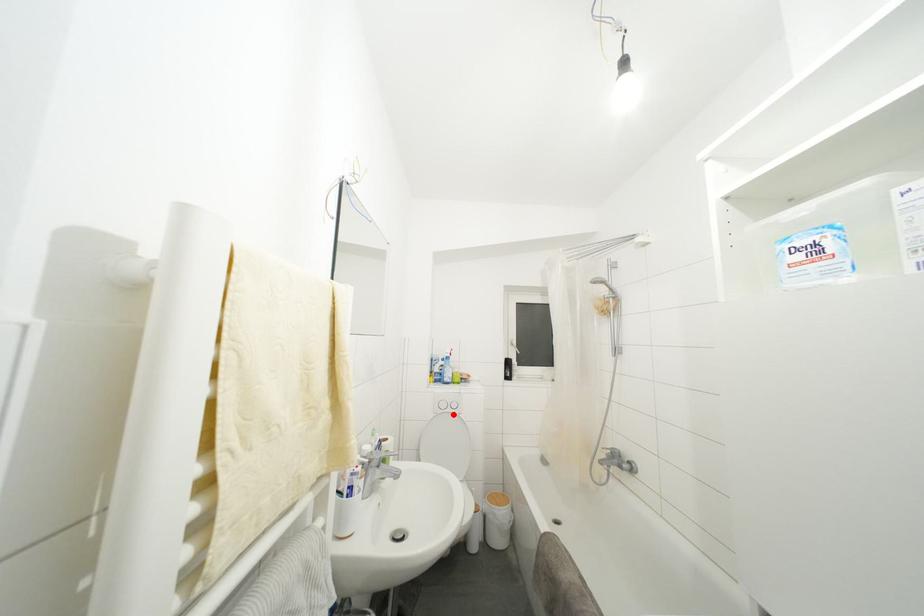
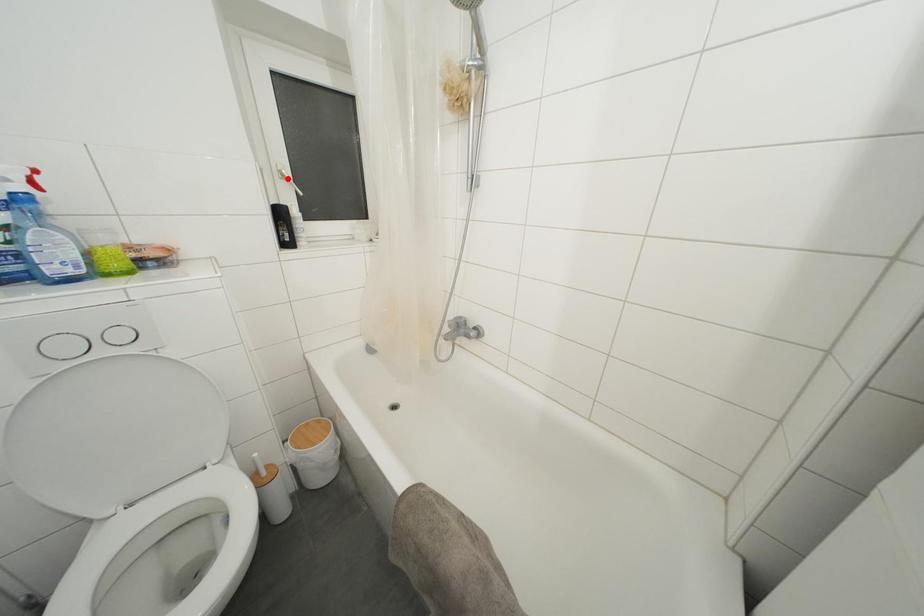
I am providing you with two images of the same scene from different viewpoints. A red point is marked on the first image and another point is marked on the second image. Is the marked point in image1 the same physical position as the marked point in image2?

No